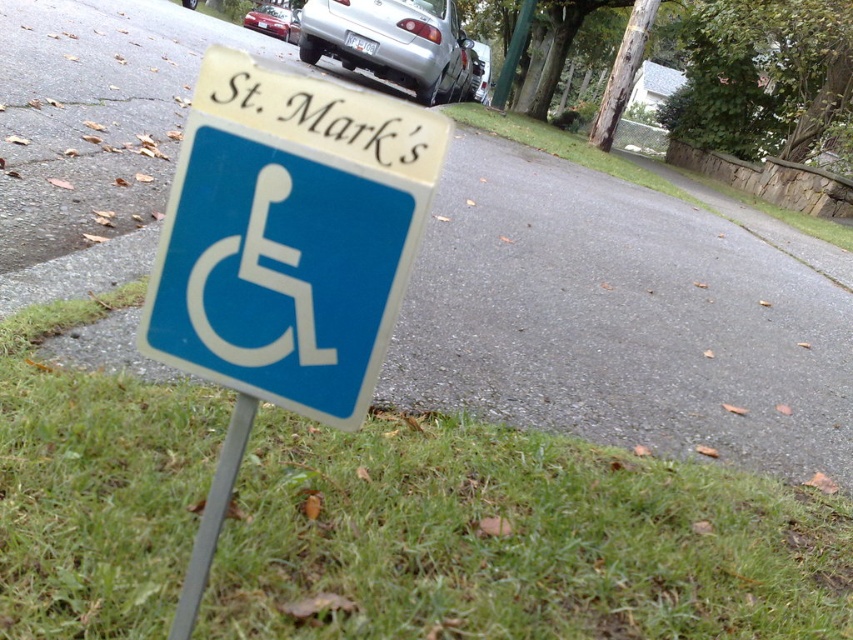
You are a delivery driver who needs to park your truck which is 2 meters wide. You see the blue plastic sign at center and the metallic pole at lower center. Is there enough space between them to park your truck?

The blue plastic sign at center is bigger than the metallic pole at lower center, but the size difference does not provide information about the space between them. Without knowing the distance between the two objects, it is impossible to determine if there is enough space to park the truck.

You are a delivery driver who needs to park your truck near the blue plastic sign at center. Your truck requires a minimum of 18 inches of clearance from any obstacles. Based on the scene, can you safely park your truck near the sign?

The blue plastic sign at center is 16.45 inches from the camera, which is less than the required 18 inches clearance. Therefore, parking the truck near the sign would not be safe due to insufficient clearance.

You are a gardener who needs to mow the lawn. You see the green grass at lower left and the silver metallic car at center. Which area should you avoid mowing to prevent damaging the car?

You should avoid mowing near the silver metallic car at center because the green grass at lower left is shorter than the silver metallic car at center, so the car is taller and could be damaged by the mower.